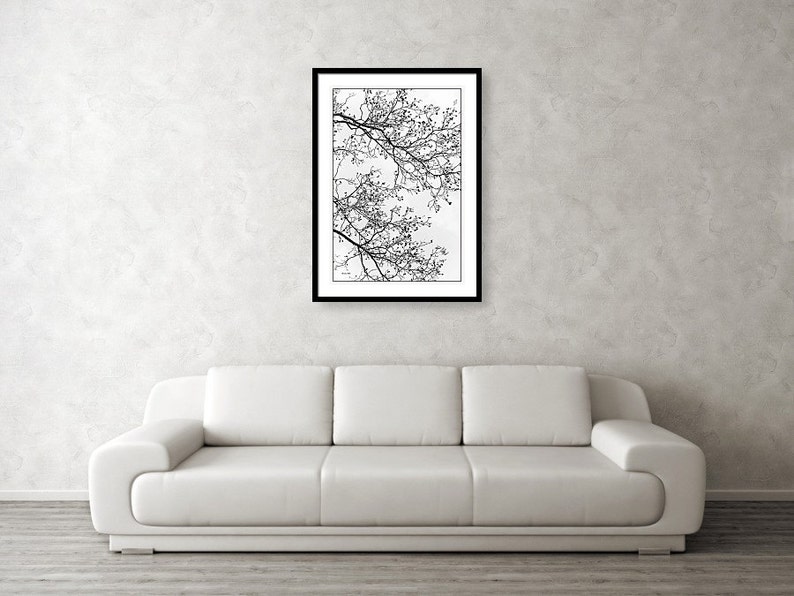
Find the location of a particular element. The height and width of the screenshot is (596, 794). back cushions is located at coordinates (260, 414), (414, 405), (529, 406).